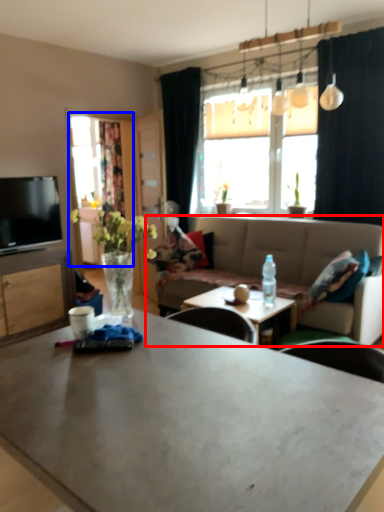
Question: Which of the following is the closest to the observer, studio couch (highlighted by a red box) or window screen (highlighted by a blue box)?

Choices:
 (A) studio couch
 (B) window screen

Answer: (A)